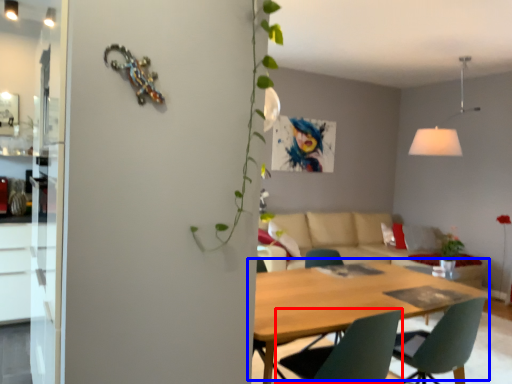
Question: Which object is closer to the camera taking this photo, chair (highlighted by a red box) or kitchen & dining room table (highlighted by a blue box)?

Choices:
 (A) chair
 (B) kitchen & dining room table

Answer: (B)